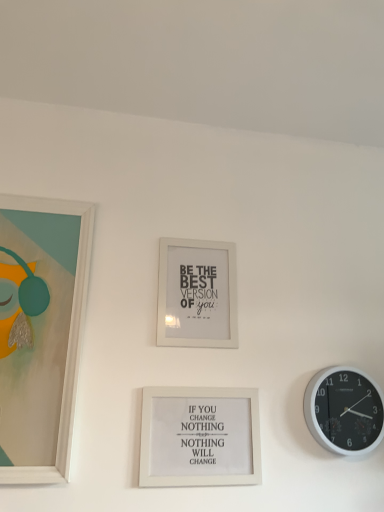
Question: Which direction should I rotate to face white matte picture frame at center, the second picture frame in the right-to-left sequence, — up or down?

Choices:
 (A) down
 (B) up

Answer: (A)

Question: Does white matte picture frame at center, the second picture frame in the right-to-left sequence, have a larger size compared to matte white picture frame at left, which appears as the first picture frame when viewed from the left?

Choices:
 (A) yes
 (B) no

Answer: (B)

Question: Does white matte picture frame at center, the 2th picture frame from the left, have a greater width compared to matte white picture frame at left, the third picture frame positioned from the right?

Choices:
 (A) yes
 (B) no

Answer: (B)

Question: Is white matte picture frame at center, the 2th picture frame from the left, looking in the opposite direction of matte white picture frame at left, which appears as the first picture frame when viewed from the left?

Choices:
 (A) yes
 (B) no

Answer: (B)

Question: Considering the relative sizes of white matte picture frame at center, the second picture frame in the right-to-left sequence, and matte white picture frame at left, the third picture frame positioned from the right, in the image provided, is white matte picture frame at center, the second picture frame in the right-to-left sequence, shorter than matte white picture frame at left, the third picture frame positioned from the right,?

Choices:
 (A) no
 (B) yes

Answer: (B)

Question: Is white matte picture frame at center, the second picture frame in the right-to-left sequence, behind matte white picture frame at left, the third picture frame positioned from the right?

Choices:
 (A) yes
 (B) no

Answer: (A)

Question: From a real-world perspective, is white matte picture frame at center, the second picture frame in the right-to-left sequence, physically above matte white picture frame at left, which appears as the first picture frame when viewed from the left?

Choices:
 (A) no
 (B) yes

Answer: (B)

Question: Is white matte picture frame at center, positioned as the third picture frame in left-to-right order, bigger than white matte picture frame at center, the 2th picture frame from the left?

Choices:
 (A) yes
 (B) no

Answer: (A)

Question: Would you say white matte picture frame at center, which is counted as the 1th picture frame, starting from the right, contains white matte picture frame at center, the 2th picture frame from the left?

Choices:
 (A) no
 (B) yes

Answer: (A)

Question: Does white matte picture frame at center, which is counted as the 1th picture frame, starting from the right, have a greater width compared to white matte picture frame at center, the 2th picture frame from the left?

Choices:
 (A) yes
 (B) no

Answer: (A)

Question: Is white matte picture frame at center, positioned as the third picture frame in left-to-right order, oriented towards white matte picture frame at center, the second picture frame in the right-to-left sequence?

Choices:
 (A) yes
 (B) no

Answer: (B)

Question: Can you see white matte picture frame at center, positioned as the third picture frame in left-to-right order, touching white matte picture frame at center, the 2th picture frame from the left?

Choices:
 (A) yes
 (B) no

Answer: (B)

Question: From the image's perspective, is white matte picture frame at center, which is counted as the 1th picture frame, starting from the right, over white matte picture frame at center, the 2th picture frame from the left?

Choices:
 (A) no
 (B) yes

Answer: (A)

Question: Is white matte picture frame at center, positioned as the third picture frame in left-to-right order, located within matte white picture frame at left, which appears as the first picture frame when viewed from the left?

Choices:
 (A) yes
 (B) no

Answer: (B)